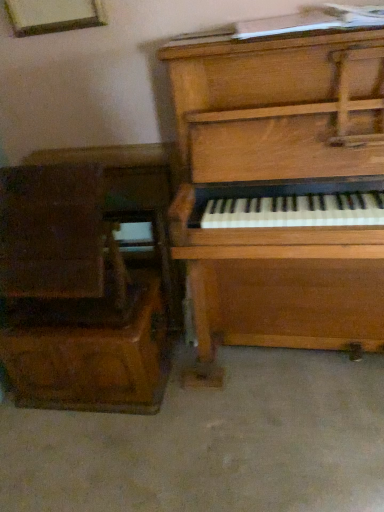
Question: Is wooden drawer at left turned away from wooden piano at right?

Choices:
 (A) yes
 (B) no

Answer: (B)

Question: From a real-world perspective, is wooden drawer at left physically above wooden piano at right?

Choices:
 (A) yes
 (B) no

Answer: (B)

Question: Can you confirm if wooden drawer at left is thinner than wooden piano at right?

Choices:
 (A) yes
 (B) no

Answer: (A)

Question: Considering the relative sizes of wooden drawer at left and wooden piano at right in the image provided, is wooden drawer at left bigger than wooden piano at right?

Choices:
 (A) yes
 (B) no

Answer: (B)

Question: Considering the relative positions of wooden drawer at left and wooden piano at right in the image provided, is wooden drawer at left behind wooden piano at right?

Choices:
 (A) no
 (B) yes

Answer: (B)

Question: From the image's perspective, is wooden drawer at left above or below smooth concrete floor at lower center?

Choices:
 (A) below
 (B) above

Answer: (B)

Question: Looking at the image, does wooden drawer at left seem bigger or smaller compared to smooth concrete floor at lower center?

Choices:
 (A) big
 (B) small

Answer: (B)

Question: Is point (119, 378) positioned closer to the camera than point (66, 418)?

Choices:
 (A) closer
 (B) farther

Answer: (A)

Question: Considering the positions of wooden drawer at left and smooth concrete floor at lower center in the image, is wooden drawer at left taller or shorter than smooth concrete floor at lower center?

Choices:
 (A) short
 (B) tall

Answer: (B)

Question: Considering the positions of wooden drawer at left and wooden piano at right in the image, is wooden drawer at left taller or shorter than wooden piano at right?

Choices:
 (A) tall
 (B) short

Answer: (B)

Question: From a real-world perspective, is wooden drawer at left physically located above or below wooden piano at right?

Choices:
 (A) below
 (B) above

Answer: (A)

Question: Looking at the image, does wooden drawer at left seem bigger or smaller compared to wooden piano at right?

Choices:
 (A) big
 (B) small

Answer: (B)

Question: Is wooden drawer at left wider or thinner than wooden piano at right?

Choices:
 (A) thin
 (B) wide

Answer: (A)

Question: Is point (100, 443) closer or farther from the camera than point (51, 333)?

Choices:
 (A) closer
 (B) farther

Answer: (B)

Question: In terms of height, does smooth concrete floor at lower center look taller or shorter compared to wooden drawer at left?

Choices:
 (A) tall
 (B) short

Answer: (B)